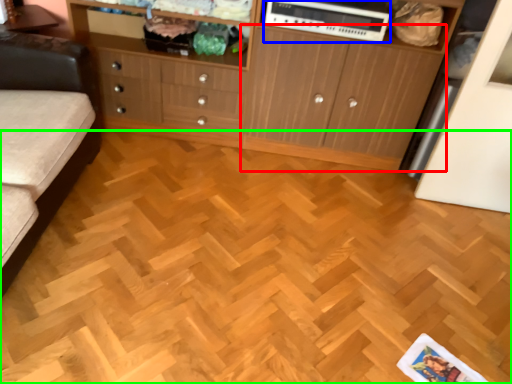
Question: Estimate the real-world distances between objects in this image. Which object is closer to cupboard (highlighted by a red box), appliance (highlighted by a blue box) or plywood (highlighted by a green box)?

Choices:
 (A) appliance
 (B) plywood

Answer: (A)